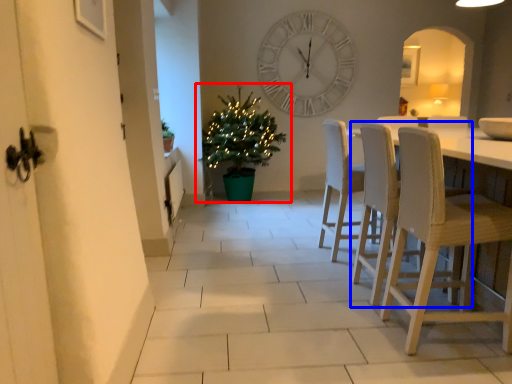
Question: Which object is closer to the camera taking this photo, houseplant (highlighted by a red box) or chair (highlighted by a blue box)?

Choices:
 (A) houseplant
 (B) chair

Answer: (B)